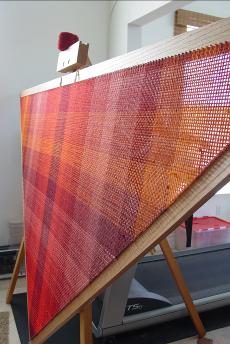
Identify the location of triangular wooden support. The height and width of the screenshot is (344, 230). (160, 55), (163, 229), (21, 157).